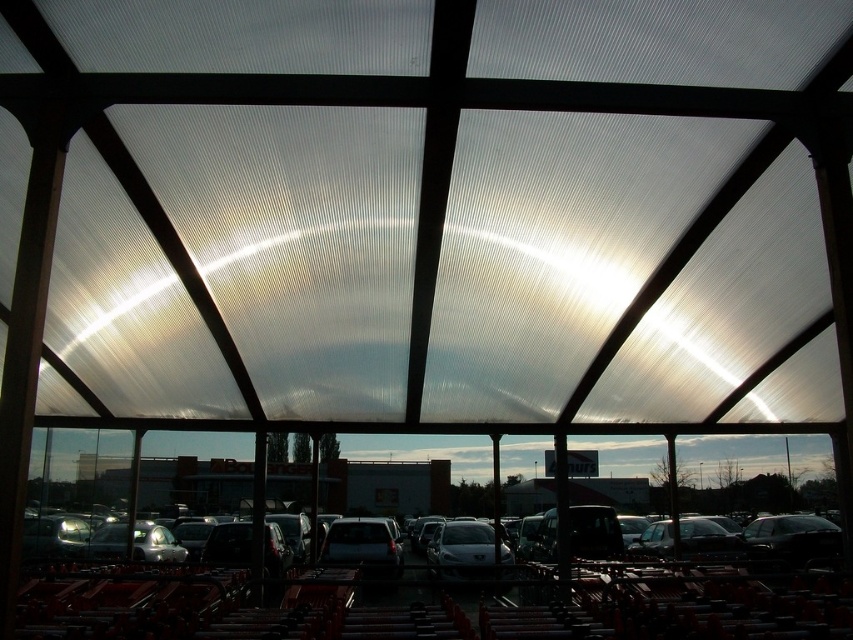
Question: Which point is closer to the camera taking this photo?

Choices:
 (A) (621, 636)
 (B) (375, 557)

Answer: (A)

Question: Can you confirm if metallic gray cars at center is positioned above matte black suv at center?

Choices:
 (A) yes
 (B) no

Answer: (A)

Question: From the image, what is the correct spatial relationship of metallic gray cars at center in relation to matte black suv at center?

Choices:
 (A) below
 (B) above

Answer: (B)

Question: Is metallic gray cars at center to the left of matte black suv at center from the viewer's perspective?

Choices:
 (A) yes
 (B) no

Answer: (B)

Question: Which object is closer to the camera taking this photo?

Choices:
 (A) metallic gray cars at center
 (B) matte black suv at center

Answer: (A)

Question: Which object is closer to the camera taking this photo?

Choices:
 (A) matte black suv at center
 (B) metallic gray cars at center

Answer: (B)